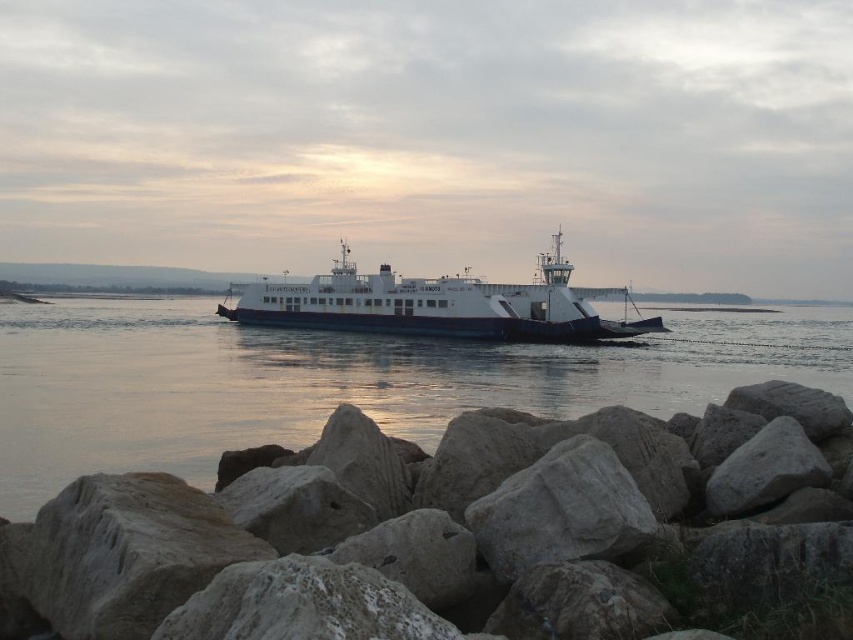
Can you confirm if smooth water at center is positioned to the left of white matte ferry at center?

In fact, smooth water at center is to the right of white matte ferry at center.

Can you confirm if smooth water at center is positioned below white matte ferry at center?

Yes, smooth water at center is below white matte ferry at center.

Between point (100, 314) and point (546, 289), which one is positioned behind?

The point (100, 314) is more distant.

Image resolution: width=853 pixels, height=640 pixels. In order to click on smooth water at center in this screenshot , I will do `click(338, 381)`.

In the scene shown: Between gray rock at lower center and smooth water at center, which one is positioned lower?

gray rock at lower center is below.

Which is more to the right, gray rock at lower center or smooth water at center?

smooth water at center

The image size is (853, 640). What are the coordinates of `gray rock at lower center` in the screenshot? It's located at (453, 531).

At what (x,y) coordinates should I click in order to perform the action: click on gray rock at lower center. Please return your answer as a coordinate pair (x, y). Looking at the image, I should click on (453, 531).

Can you confirm if gray rock at lower center is taller than white matte ferry at center?

No, gray rock at lower center is not taller than white matte ferry at center.

Is point (1, 579) farther from camera compared to point (502, 289)?

No, (1, 579) is in front of (502, 289).

Which is behind, point (227, 595) or point (488, 333)?

The point (488, 333) is behind.

Where is `gray rock at lower center`? gray rock at lower center is located at coordinates pyautogui.click(x=453, y=531).